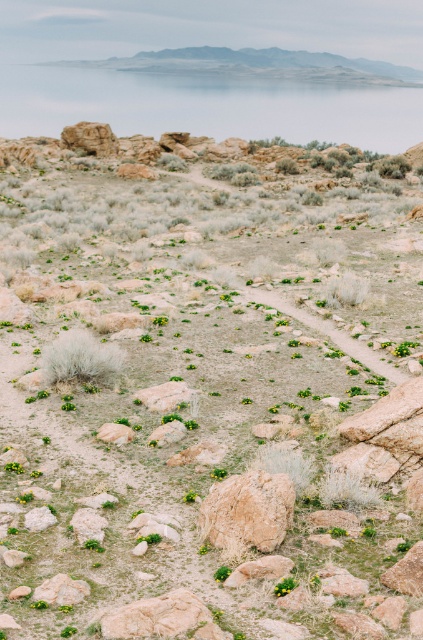
Who is more distant from viewer, (197,90) or (216,502)?

The point (197,90) is behind.

Who is positioned more to the right, transparent glass lake at upper center or brown rough rock at center?

brown rough rock at center is more to the right.

Which is behind, point (246, 115) or point (238, 500)?

Positioned behind is point (246, 115).

Identify the location of transparent glass lake at upper center. This screenshot has width=423, height=640. (208, 106).